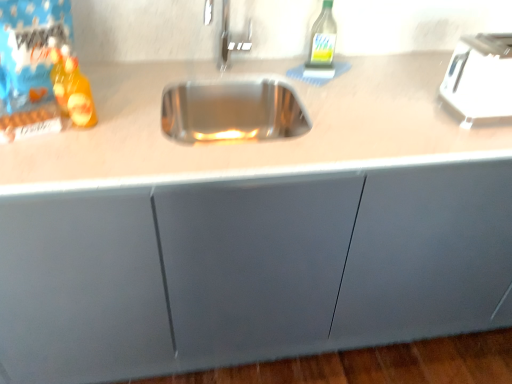
Where is `vacant space that's between white plastic toaster at upper right and green glass bottle at upper right, which ranks as the 1th bottle in top-to-bottom order`? The height and width of the screenshot is (384, 512). vacant space that's between white plastic toaster at upper right and green glass bottle at upper right, which ranks as the 1th bottle in top-to-bottom order is located at coordinates (382, 86).